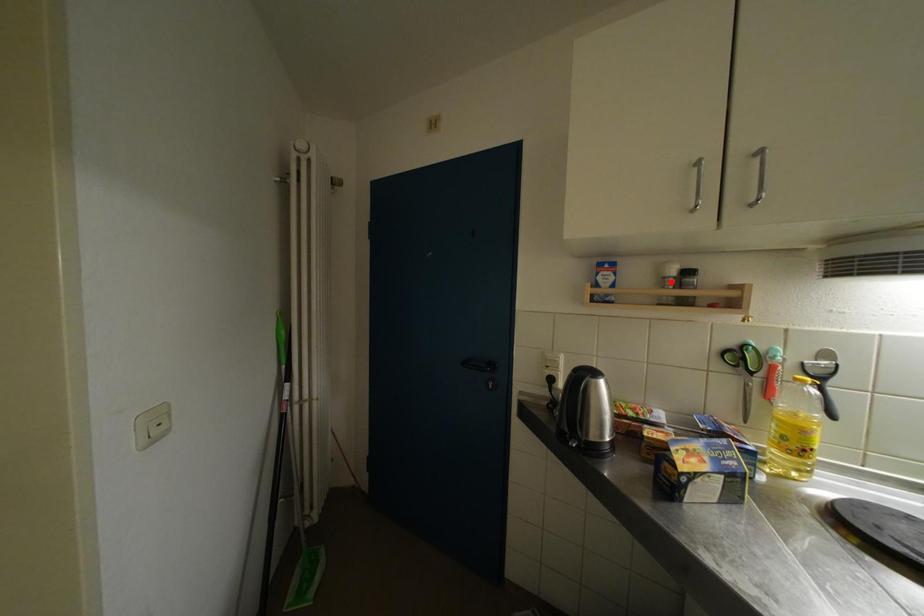
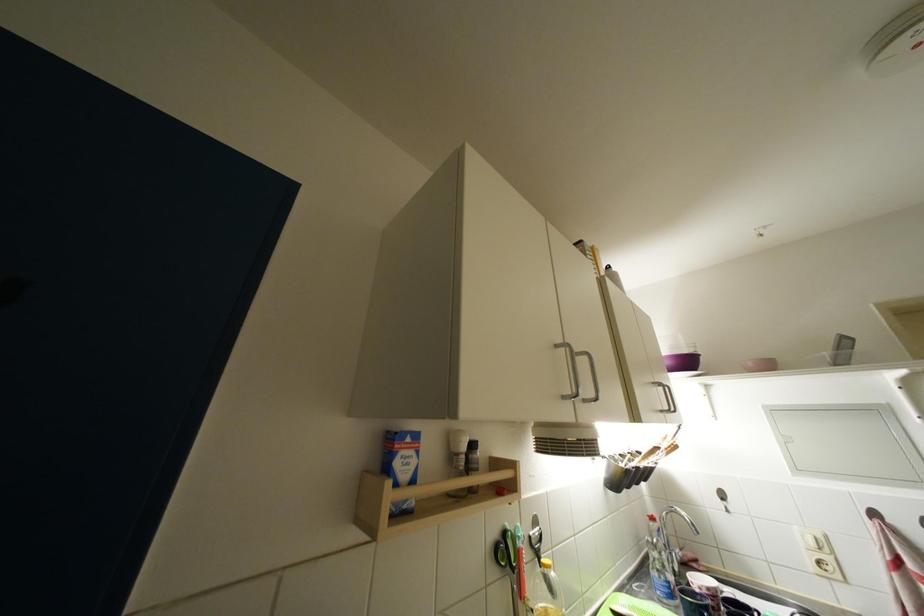
The point at the highlighted location is marked in the first image. Where is the corresponding point in the second image?

(464, 458)